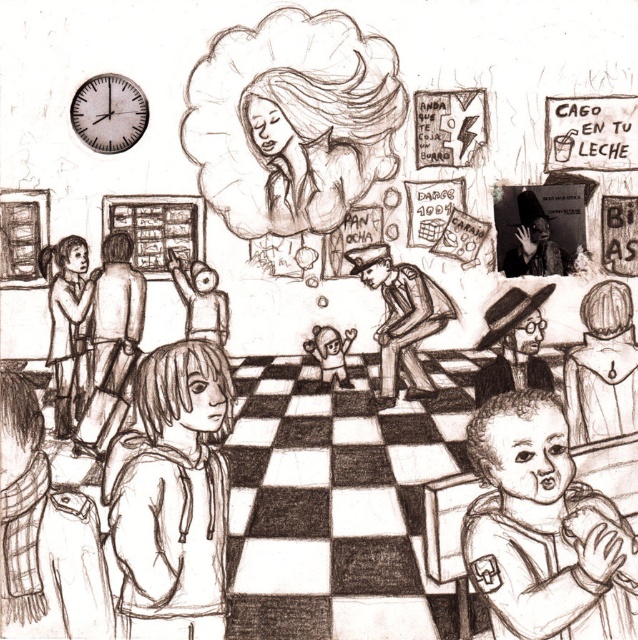
Can you confirm if smooth skin baby at lower right is taller than smooth hoodie at center?

No.

Between smooth skin baby at lower right and smooth hoodie at center, which one is positioned lower?

smooth skin baby at lower right is below.

The width and height of the screenshot is (638, 640). Describe the element at coordinates (542, 529) in the screenshot. I see `smooth skin baby at lower right` at that location.

The image size is (638, 640). Identify the location of smooth skin baby at lower right. (542, 529).

Which is more to the right, smooth brown uniform at center or smooth beige doll at center?

smooth brown uniform at center is more to the right.

Can you confirm if smooth brown uniform at center is thinner than smooth beige doll at center?

No.

The image size is (638, 640). What do you see at coordinates (401, 316) in the screenshot? I see `smooth brown uniform at center` at bounding box center [401, 316].

The height and width of the screenshot is (640, 638). Identify the location of smooth brown uniform at center. (401, 316).

Which is in front, point (575, 552) or point (54, 344)?

Point (575, 552) is more forward.

This screenshot has height=640, width=638. What do you see at coordinates (542, 529) in the screenshot?
I see `smooth skin baby at lower right` at bounding box center [542, 529].

Between point (510, 632) and point (71, 330), which one is positioned in front?

Positioned in front is point (510, 632).

At what (x,y) coordinates should I click in order to perform the action: click on smooth skin baby at lower right. Please return your answer as a coordinate pair (x, y). Looking at the image, I should click on (542, 529).